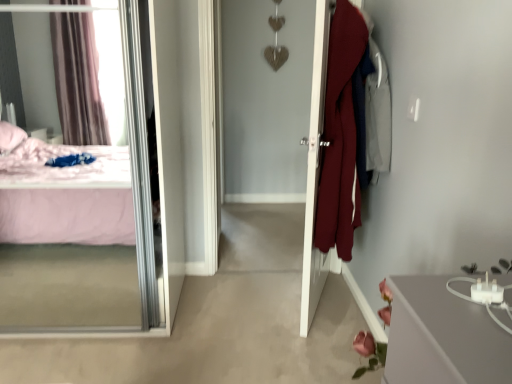
In order to click on white glossy door at center in this screenshot , I will do `click(331, 151)`.

The width and height of the screenshot is (512, 384). What do you see at coordinates (331, 151) in the screenshot?
I see `white glossy door at center` at bounding box center [331, 151].

You are a GUI agent. You are given a task and a screenshot of the screen. Output one action in this format:
    pyautogui.click(x=<x>, y=<y>)
    Task: Click on the transparent glass mirror at left
    The height and width of the screenshot is (384, 512).
    Given the screenshot: What is the action you would take?
    [81, 228]

Describe the element at coordinates (81, 228) in the screenshot. I see `transparent glass mirror at left` at that location.

Locate an element on the screen. white glossy door at center is located at coordinates 331,151.

Does transparent glass mirror at left appear on the right side of white glossy door at center?

No.

Is the position of transparent glass mirror at left less distant than that of white glossy door at center?

Yes, it is.

Is point (126, 247) farther from viewer compared to point (318, 68)?

Yes, point (126, 247) is behind point (318, 68).

From the image's perspective, is transparent glass mirror at left beneath white glossy door at center?

Correct, transparent glass mirror at left appears lower than white glossy door at center in the image.

From a real-world perspective, is transparent glass mirror at left under white glossy door at center?

Yes, from a real-world perspective, transparent glass mirror at left is under white glossy door at center.

Considering the sizes of objects transparent glass mirror at left and white glossy door at center in the image provided, who is wider, transparent glass mirror at left or white glossy door at center?

transparent glass mirror at left.

Which of these two, transparent glass mirror at left or white glossy door at center, stands taller?

With more height is white glossy door at center.

Considering the sizes of transparent glass mirror at left and white glossy door at center in the image, is transparent glass mirror at left bigger or smaller than white glossy door at center?

Clearly, transparent glass mirror at left is larger in size than white glossy door at center.

Is white glossy door at center inside transparent glass mirror at left?

No.

Is transparent glass mirror at left with white glossy door at center?

No, transparent glass mirror at left is not in contact with white glossy door at center.

Could you tell me if transparent glass mirror at left is facing white glossy door at center?

No, transparent glass mirror at left is not aimed at white glossy door at center.

How many degrees apart are the facing directions of transparent glass mirror at left and white glossy door at center?

They differ by 111 degrees in their facing directions.

Locate an element on the screen. This screenshot has height=384, width=512. door lying above the transparent glass mirror at left (from the image's perspective) is located at coordinates (331, 151).

Is white glossy door at center at the right side of transparent glass mirror at left?

Yes.

Does white glossy door at center come in front of transparent glass mirror at left?

That is False.

Which point is more forward, [344,68] or [62,190]?

The point [344,68] is in front.

From the image's perspective, which one is positioned lower, white glossy door at center or transparent glass mirror at left?

transparent glass mirror at left, from the image's perspective.

From a real-world perspective, is white glossy door at center on top of transparent glass mirror at left?

Yes, from a real-world perspective, white glossy door at center is over transparent glass mirror at left

Considering the relative sizes of white glossy door at center and transparent glass mirror at left in the image provided, is white glossy door at center thinner than transparent glass mirror at left?

Correct, the width of white glossy door at center is less than that of transparent glass mirror at left.

In terms of height, does white glossy door at center look taller or shorter compared to transparent glass mirror at left?

white glossy door at center is taller than transparent glass mirror at left.

Can you confirm if white glossy door at center is smaller than transparent glass mirror at left?

Yes, white glossy door at center is smaller than transparent glass mirror at left.

Does white glossy door at center contain transparent glass mirror at left?

Definitely not — transparent glass mirror at left is not inside white glossy door at center.

Are white glossy door at center and transparent glass mirror at left far apart?

Yes, white glossy door at center and transparent glass mirror at left are quite far apart.

Does white glossy door at center turn towards transparent glass mirror at left?

Yes, white glossy door at center is facing transparent glass mirror at left.

Locate an element on the screen. mirror in front of the white glossy door at center is located at coordinates (81, 228).

Identify the location of mirror below the white glossy door at center (from a real-world perspective). The width and height of the screenshot is (512, 384). coord(81,228).

Identify the location of mirror on the left of the white glossy door at center. The height and width of the screenshot is (384, 512). (81, 228).